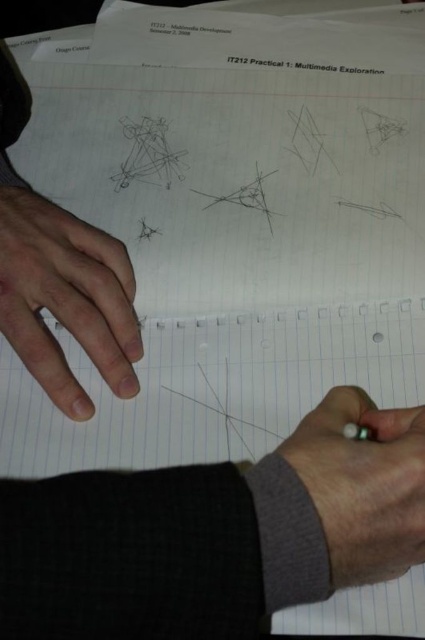
Between point (39, 241) and point (385, 490), which one is positioned in front?

Point (385, 490)

Based on the photo, which is more to the left, dry skin at left or gray woolen sweater at lower right?

Positioned to the left is dry skin at left.

Is point (87, 348) positioned in front of point (376, 515)?

No, it is not.

Where is `dry skin at left`? Image resolution: width=425 pixels, height=640 pixels. dry skin at left is located at coordinates (65, 298).